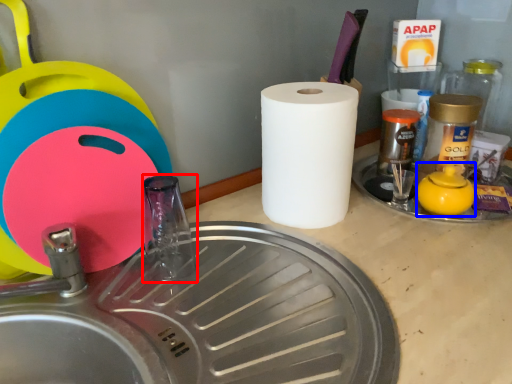
Question: Which point is further to the camera, faucet (highlighted by a red box) or tea pot (highlighted by a blue box)?

Choices:
 (A) faucet
 (B) tea pot

Answer: (B)